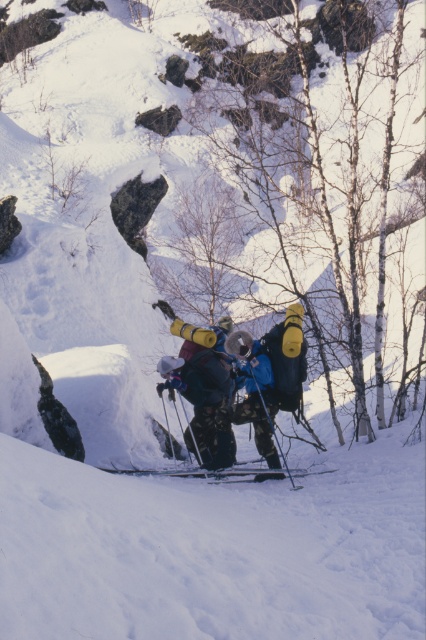
Is dark blue ski suit at center positioned at the back of matte black ski pole at center?

Yes.

Who is taller, dark blue ski suit at center or matte black ski pole at center?

With more height is dark blue ski suit at center.

The width and height of the screenshot is (426, 640). Find the location of `dark blue ski suit at center`. dark blue ski suit at center is located at coordinates (198, 392).

Who is shorter, black matte ski at center or matte black ski pole at center?

black matte ski at center

Does black matte ski at center have a lesser height compared to matte black ski pole at center?

Yes, black matte ski at center is shorter than matte black ski pole at center.

Between point (265, 477) and point (268, 416), which one is positioned in front?

Point (268, 416) is in front.

In order to click on black matte ski at center in this screenshot , I will do `click(222, 472)`.

Can you confirm if dark blue ski suit at center is thinner than black matte ski at center?

Yes, dark blue ski suit at center is thinner than black matte ski at center.

What do you see at coordinates (198, 392) in the screenshot? I see `dark blue ski suit at center` at bounding box center [198, 392].

Between point (187, 353) and point (296, 474), which one is positioned in front?

Positioned in front is point (296, 474).

I want to click on dark blue ski suit at center, so tap(198, 392).